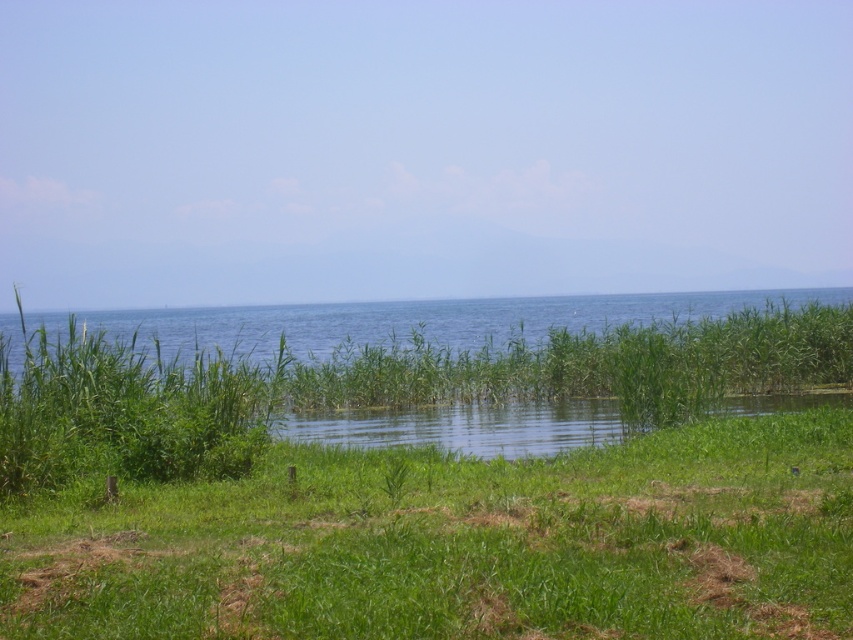
Question: Is green grassy at lower center in front of green grassy water at center?

Choices:
 (A) no
 (B) yes

Answer: (B)

Question: Is green grassy at lower center smaller than green grassy water at center?

Choices:
 (A) yes
 (B) no

Answer: (A)

Question: Which of the following is the farthest from the observer?

Choices:
 (A) (360, 305)
 (B) (775, 557)

Answer: (A)

Question: Is green grassy at lower center to the right of green grassy water at center from the viewer's perspective?

Choices:
 (A) yes
 (B) no

Answer: (B)